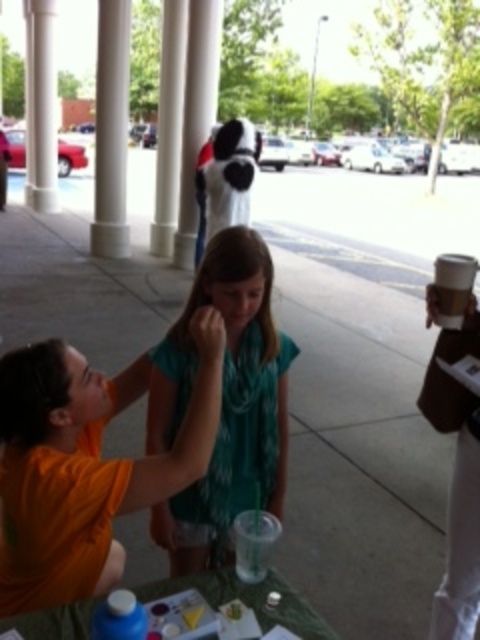
Is point (26, 612) positioned before point (52, 65)?

Yes.

Between translucent plastic table at lower center and white smooth column at upper left, which one appears on the right side from the viewer's perspective?

translucent plastic table at lower center is more to the right.

Between point (313, 624) and point (54, 76), which one is positioned behind?

The point (54, 76) is more distant.

Locate an element on the screen. Image resolution: width=480 pixels, height=640 pixels. translucent plastic table at lower center is located at coordinates (247, 600).

Who is positioned more to the right, orange cotton shirt at upper left or teal fabric scarf at center?

teal fabric scarf at center

Consider the image. Who is higher up, orange cotton shirt at upper left or teal fabric scarf at center?

Positioned higher is teal fabric scarf at center.

Identify the location of orange cotton shirt at upper left. (84, 465).

Where is `orange cotton shirt at upper left`? orange cotton shirt at upper left is located at coordinates (84, 465).

Is white smooth pillar at upper center closer to the viewer compared to white smooth column at upper left?

Yes, white smooth pillar at upper center is closer to the viewer.

Between point (179, 248) and point (39, 113), which one is positioned in front?

Point (179, 248) is in front.

In order to click on white smooth pillar at upper center in this screenshot , I will do `click(196, 115)`.